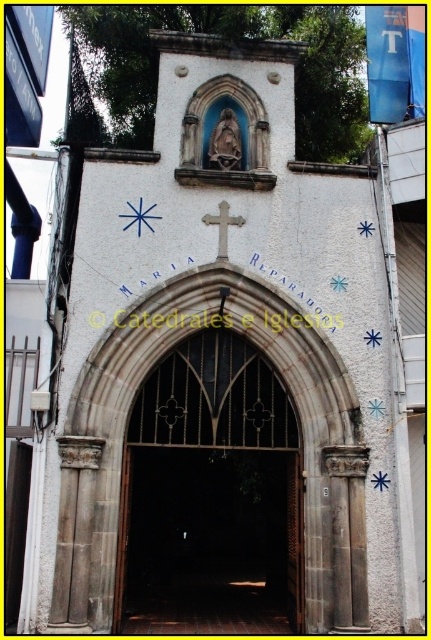
Question: Where is dark brown stone arch at center located in relation to white stone cross at center in the image?

Choices:
 (A) below
 (B) above

Answer: (A)

Question: Among these points, which one is farthest from the camera?

Choices:
 (A) 227,253
 (B) 186,406

Answer: (A)

Question: Which point is farther to the camera?

Choices:
 (A) (212, 216)
 (B) (281, 548)

Answer: (B)

Question: Can you confirm if dark brown stone arch at center is positioned below white stone cross at center?

Choices:
 (A) yes
 (B) no

Answer: (A)

Question: Is the position of dark brown stone arch at center more distant than that of white stone cross at center?

Choices:
 (A) no
 (B) yes

Answer: (A)